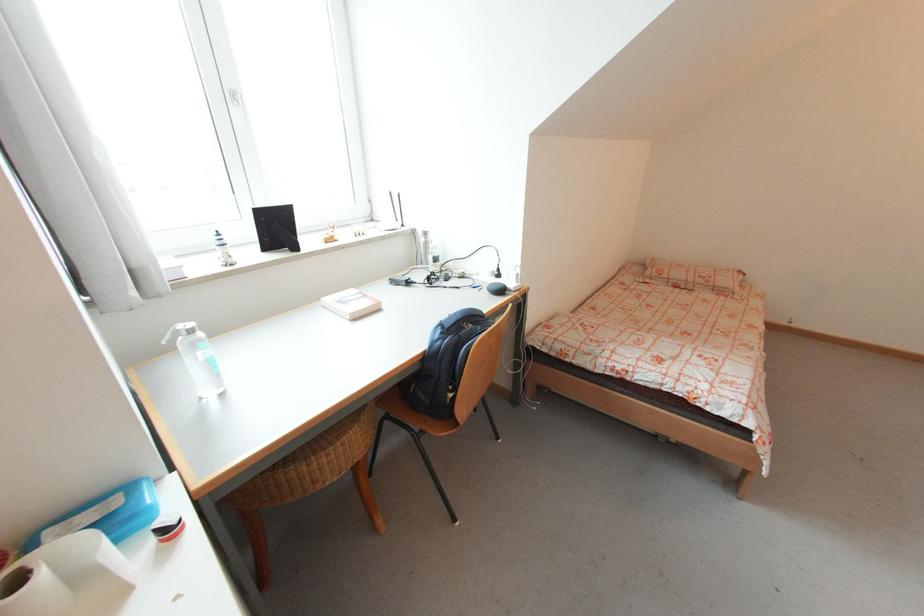
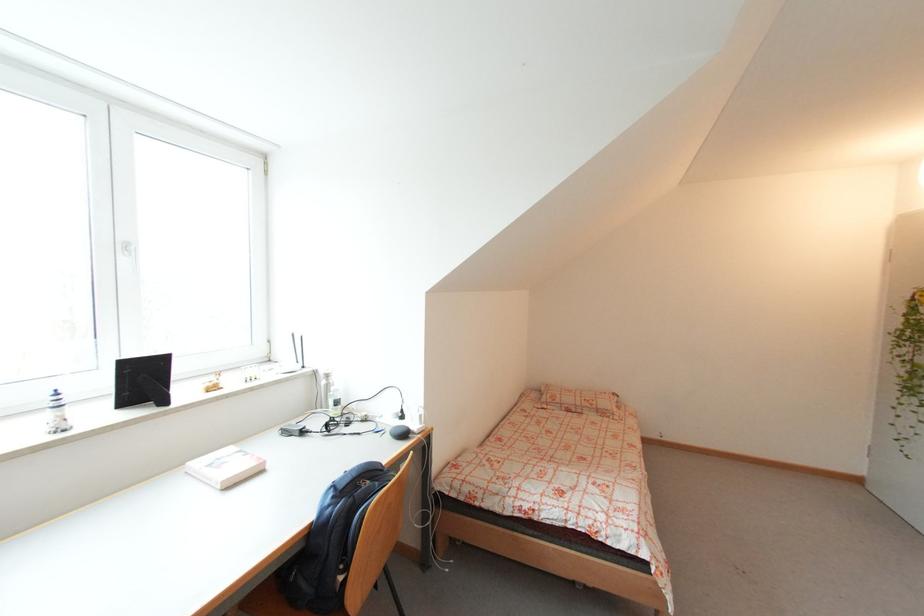
Where in the second image is the point corresponding to point 661,278 from the first image?

(555, 405)